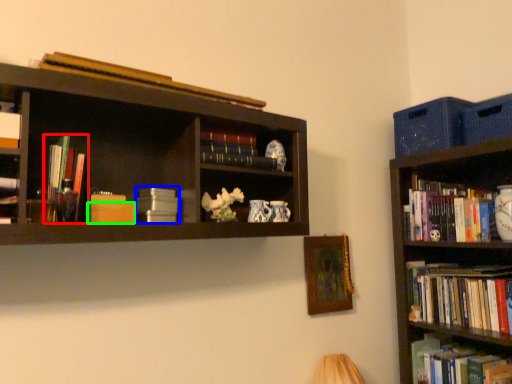
Question: Which is farther away from book (highlighted by a red box)? book (highlighted by a blue box) or paperback book (highlighted by a green box)?

Choices:
 (A) book
 (B) paperback book

Answer: (A)